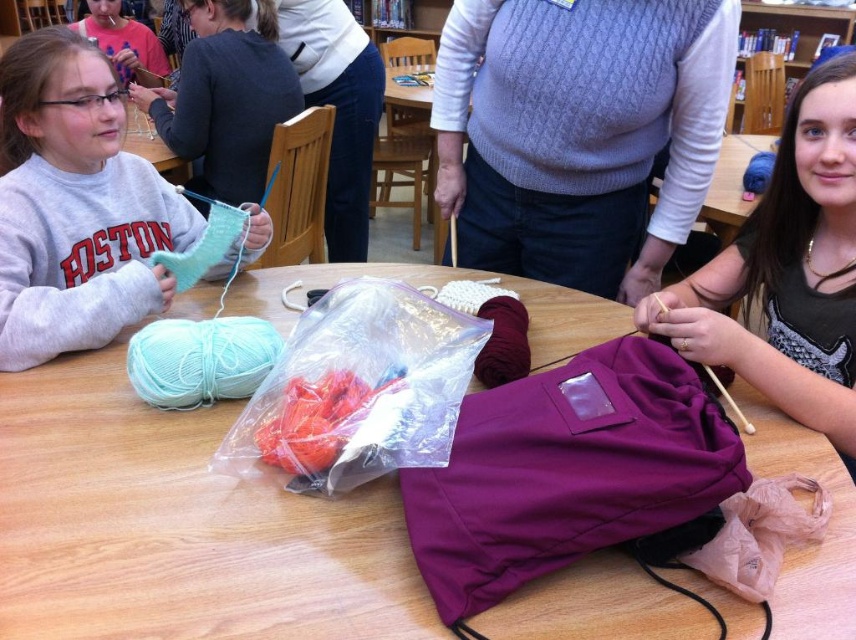
Question: Which object appears farthest from the camera in this image?

Choices:
 (A) purple fabric at center
 (B) gray cotton sweatshirt at left
 (C) wooden table at center

Answer: (B)

Question: Which of these objects is positioned closest to the gray cotton sweatshirt at left?

Choices:
 (A) purple fabric at center
 (B) wooden table at center
 (C) matte pink sweater at upper left

Answer: (B)

Question: Is gray cotton sweatshirt at left below purple fabric at center?

Choices:
 (A) yes
 (B) no

Answer: (B)

Question: Is purple fabric at center to the right of matte pink sweater at upper left from the viewer's perspective?

Choices:
 (A) no
 (B) yes

Answer: (B)

Question: Which of the following is the closest to the observer?

Choices:
 (A) (270, 522)
 (B) (818, 358)
 (C) (86, 29)
 (D) (25, 148)

Answer: (A)

Question: Does purple fabric at center appear over matte pink sweater at upper left?

Choices:
 (A) yes
 (B) no

Answer: (B)